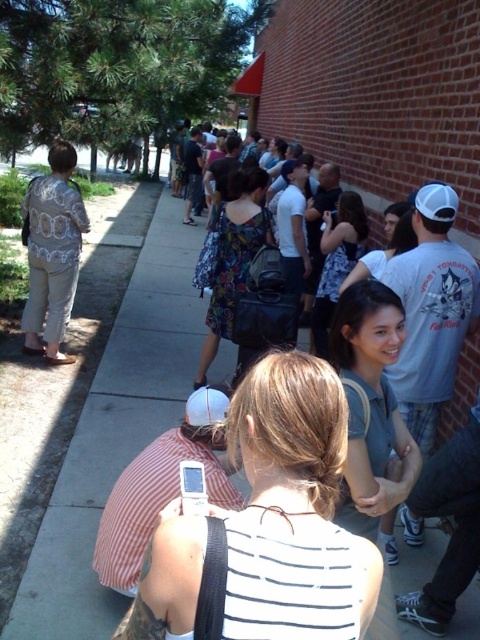
Is the position of white striped shirt at center less distant than that of light beige fabric dress at left?

Yes.

Is white striped shirt at center smaller than light beige fabric dress at left?

Yes, white striped shirt at center is smaller than light beige fabric dress at left.

Is point (292, 493) positioned behind point (25, 196)?

No, it is not.

The width and height of the screenshot is (480, 640). What are the coordinates of `white striped shirt at center` in the screenshot? It's located at (266, 525).